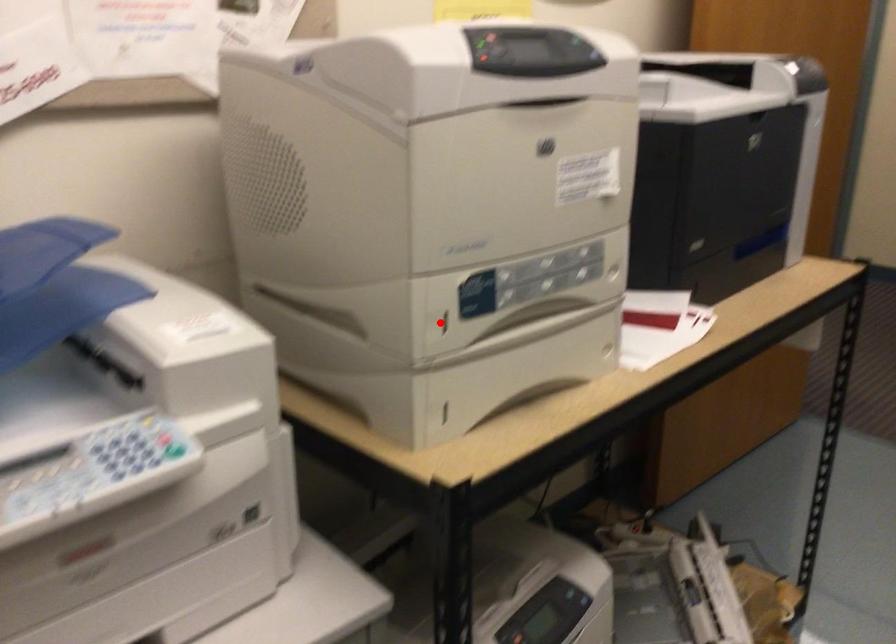
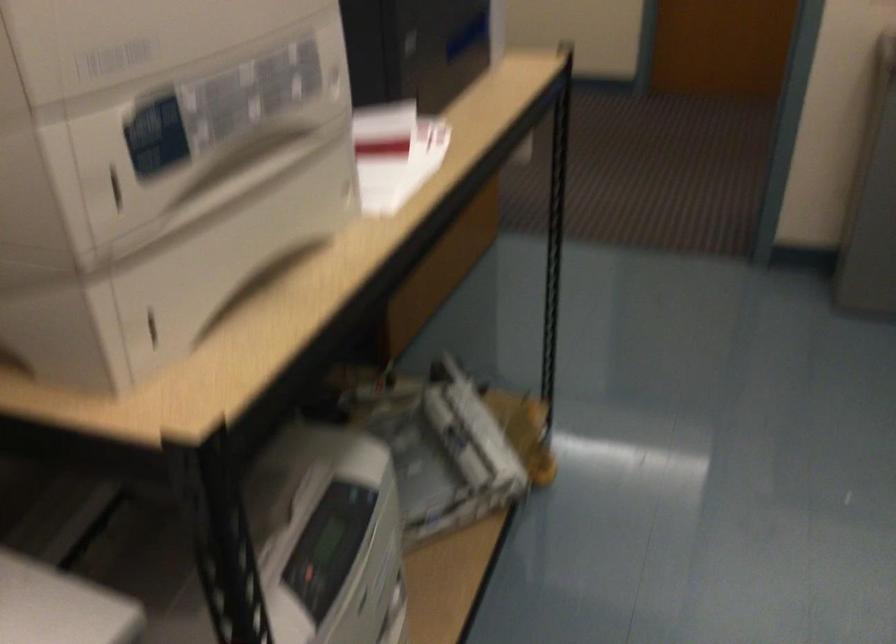
Locate, in the second image, the point that corresponds to the highlighted location in the first image.

(116, 189)